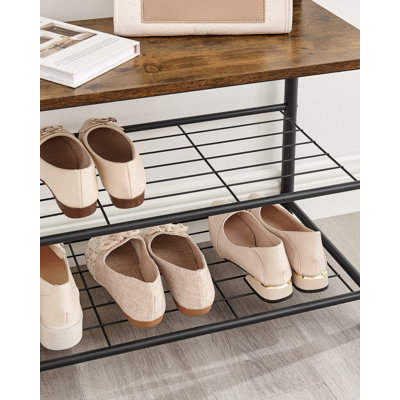
This screenshot has height=400, width=400. Identify the location of shoe. 73,173, 126,175, 62,308, 141,295, 193,283, 269,271, 320,265.